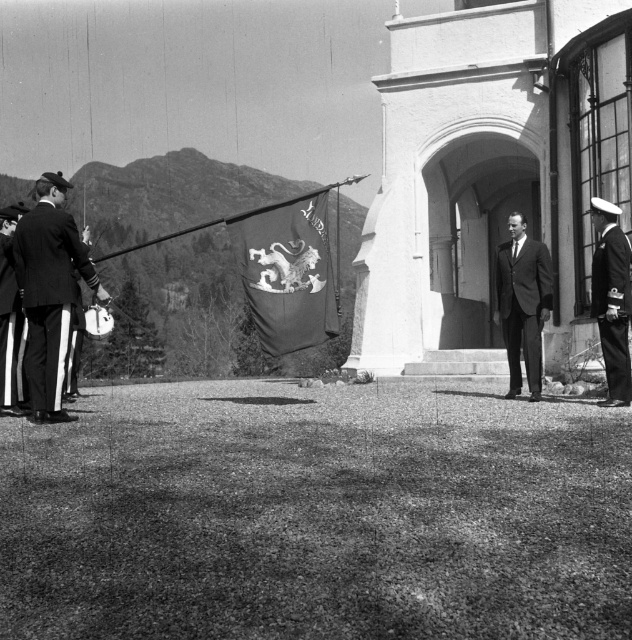
Who is lower down, dark gray suit at center or shiny black uniform at right?

dark gray suit at center is below.

Is point (526, 237) less distant than point (605, 250)?

No, it is behind (605, 250).

Find the location of a particular element. This screenshot has width=632, height=640. dark gray suit at center is located at coordinates (523, 307).

Image resolution: width=632 pixels, height=640 pixels. I want to click on dark gray suit at center, so click(x=523, y=307).

Which of these two, silky fabric flag at center or uniformed man at left, stands shorter?

With less height is uniformed man at left.

Can you confirm if silky fabric flag at center is thinner than uniformed man at left?

No, silky fabric flag at center is not thinner than uniformed man at left.

This screenshot has height=640, width=632. Describe the element at coordinates (288, 272) in the screenshot. I see `silky fabric flag at center` at that location.

Image resolution: width=632 pixels, height=640 pixels. In order to click on silky fabric flag at center in this screenshot , I will do `click(288, 272)`.

Looking at this image, is the position of silky fabric flag at center less distant than that of dark gray suit at center?

Yes, silky fabric flag at center is in front of dark gray suit at center.

Is silky fabric flag at center above dark gray suit at center?

Indeed, silky fabric flag at center is positioned over dark gray suit at center.

Who is more distant from viewer, (327, 243) or (525, 307)?

Positioned behind is point (525, 307).

Where is `silky fabric flag at center`? The image size is (632, 640). silky fabric flag at center is located at coordinates (288, 272).